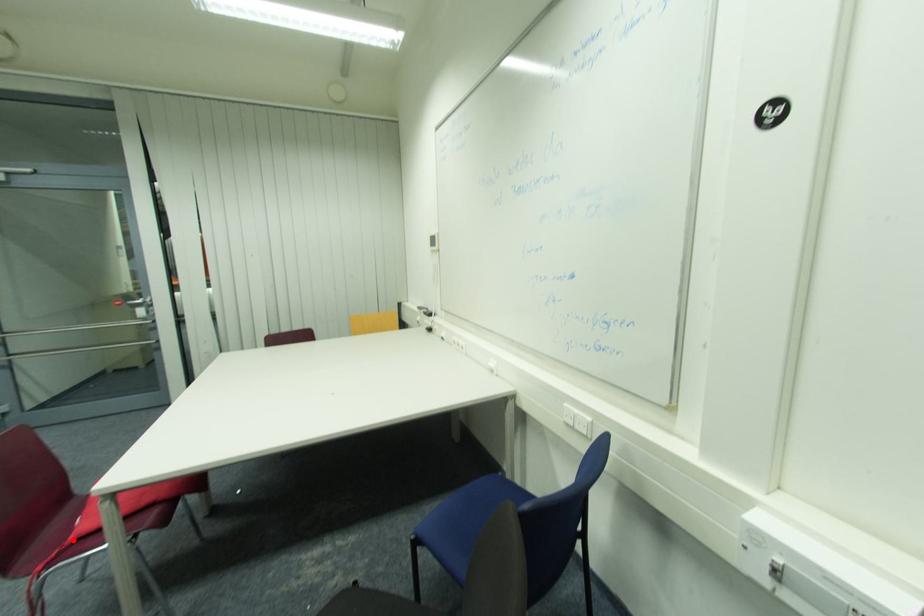
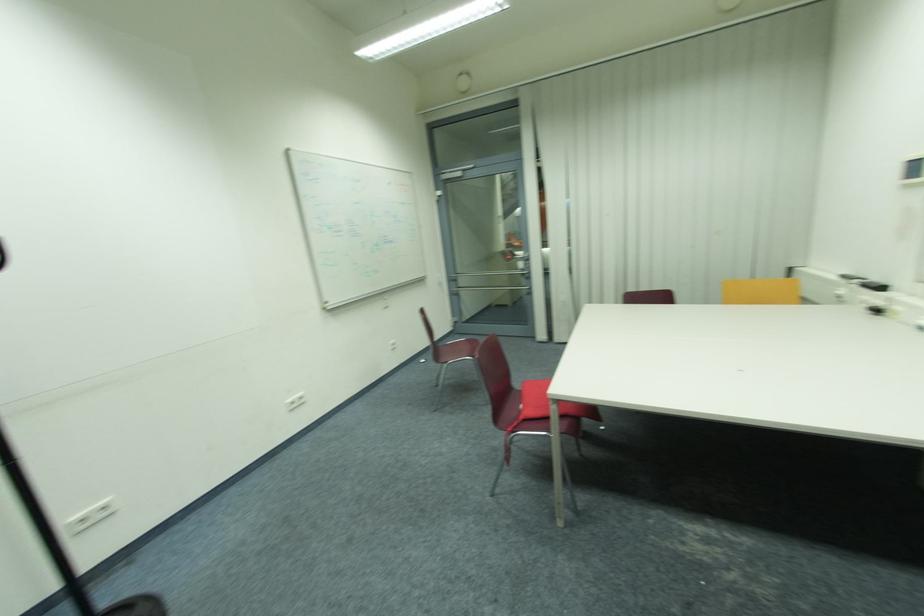
Question: I am providing you with two images of the same scene from different viewpoints. Given a red point in image1, look at the same physical point in image2. Is it:

Choices:
 (A) Closer to the viewpoint
 (B) Farther from the viewpoint

Answer: (B)